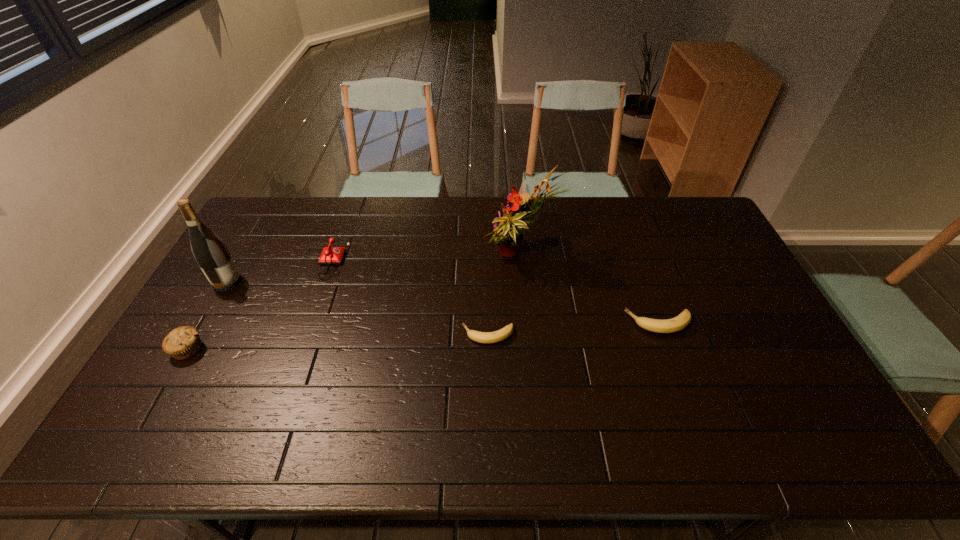
Identify the location of the shortest object. (482, 337).

Where is `the shorter banana`? the shorter banana is located at coordinates (482, 337).

At what (x,y) coordinates should I click in order to perform the action: click on the right banana. Please return your answer as a coordinate pair (x, y). Looking at the image, I should click on (678, 323).

Locate an element on the screen. The width and height of the screenshot is (960, 540). the rightmost object is located at coordinates (678, 323).

You are a GUI agent. You are given a task and a screenshot of the screen. Output one action in this format:
    pyautogui.click(x=<x>, y=<y>)
    Task: Click on the third object from left to right
    
    Given the screenshot: What is the action you would take?
    pyautogui.click(x=330, y=255)

Find the location of a particular element. Image resolution: width=960 pixels, height=540 pixels. the third shortest object is located at coordinates (330, 255).

Locate an element on the screen. wine bottle is located at coordinates (210, 252).

I want to click on bouquet, so 508,229.

I want to click on muffin, so click(183, 342).

Image resolution: width=960 pixels, height=540 pixels. Find the location of `vacant region located at the stem of the shorter banana`. vacant region located at the stem of the shorter banana is located at coordinates (406, 335).